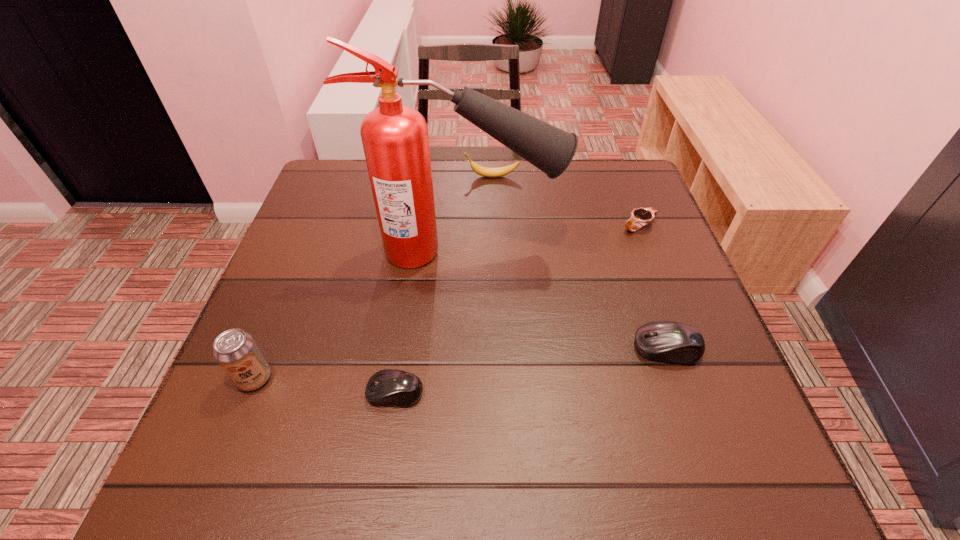
Image resolution: width=960 pixels, height=540 pixels. I want to click on beer can that is at the near edge, so click(x=235, y=350).

Find the location of `object located in the left edge section of the desktop`. object located in the left edge section of the desktop is located at coordinates (235, 350).

In order to click on mouse at the right edge in this screenshot , I will do `click(666, 341)`.

The height and width of the screenshot is (540, 960). Identify the location of watch present at the right edge. (641, 216).

You are a GUI agent. You are given a task and a screenshot of the screen. Output one action in this format:
    pyautogui.click(x=<x>, y=<y>)
    Task: Click on the object present at the near left corner
    
    Given the screenshot: What is the action you would take?
    pyautogui.click(x=235, y=350)

Where is `free point at the far edge`? This screenshot has width=960, height=540. free point at the far edge is located at coordinates (471, 178).

You are a GUI agent. You are given a task and a screenshot of the screen. Output one action in this format:
    pyautogui.click(x=<x>, y=<y>)
    Task: Click on the vacant space at the near edge of the desktop
    The height and width of the screenshot is (540, 960).
    Given the screenshot: What is the action you would take?
    pyautogui.click(x=646, y=418)

This screenshot has height=540, width=960. Find the location of `vacant region at the left edge of the desktop`. vacant region at the left edge of the desktop is located at coordinates (290, 313).

The height and width of the screenshot is (540, 960). In the image, there is a desktop. Identify the location of free region at the right edge. (604, 215).

The width and height of the screenshot is (960, 540). Identify the location of vacant space at the far left corner. (337, 195).